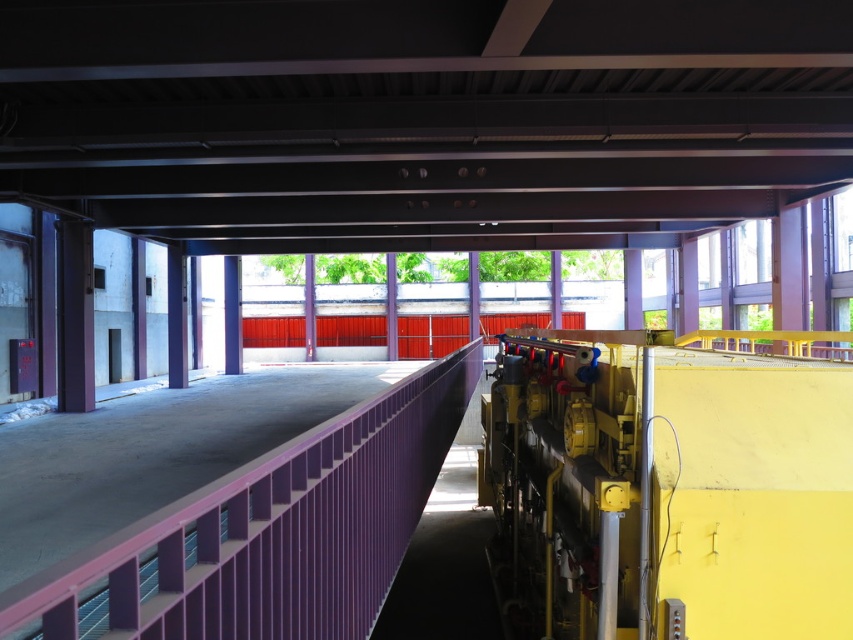
Which is in front, point (598, 152) or point (238, 348)?

Point (598, 152) is in front.

Does metal at center have a larger size compared to purple metal/rail at center?

Indeed, metal at center has a larger size compared to purple metal/rail at center.

The width and height of the screenshot is (853, 640). What do you see at coordinates (422, 116) in the screenshot?
I see `metal at center` at bounding box center [422, 116].

This screenshot has height=640, width=853. I want to click on metal at center, so click(422, 116).

In the scene shown: Which is more to the left, metal at center or purple metallic rail at center?

metal at center is more to the left.

Who is positioned more to the right, metal at center or purple metallic rail at center?

purple metallic rail at center

Is point (167, 200) positioned before point (128, 540)?

No.

Where is `metal at center`? metal at center is located at coordinates (422, 116).

Consider the image. Does purple metallic rail at center appear on the left side of purple metal/rail at center?

Incorrect, purple metallic rail at center is not on the left side of purple metal/rail at center.

Is purple metallic rail at center below purple metal/rail at center?

Indeed, purple metallic rail at center is positioned under purple metal/rail at center.

Identify the location of purple metallic rail at center. (268, 532).